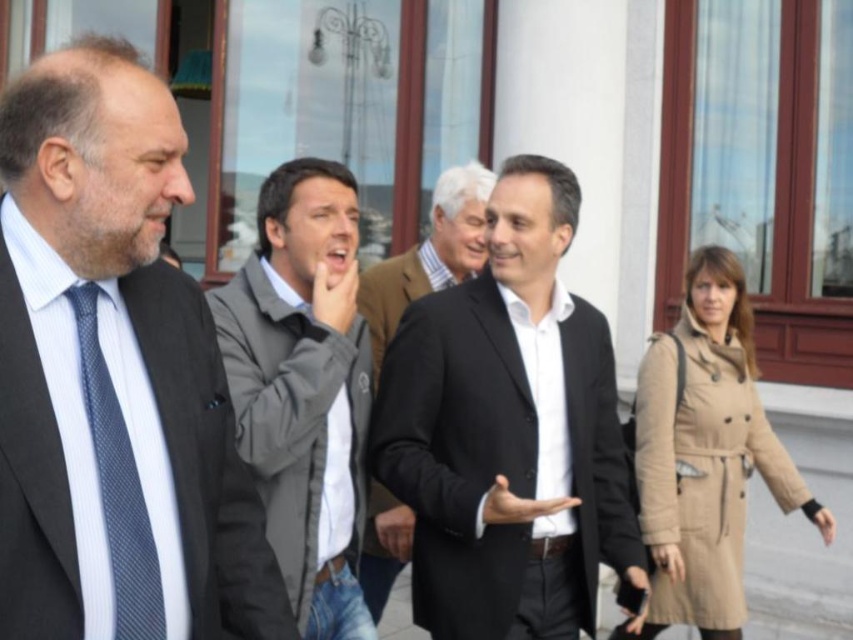
You are standing in front of the building with large windows. You notice two points marked in the scene. The first point is at coordinate point (x=76, y=83) and the second is at point (x=521, y=573). Which point is closer to you?

Point (x=76, y=83) is closer to the viewer than point (x=521, y=573).

You are a photographer standing 3 meters away from the black wool coat at center and the black wool suit at center. You want to capture both in a single shot without zooming. Can you fit both into your camera frame if your camera has a 1.5 meter field of view?

The distance between the black wool coat at center and black wool suit at center is 2.46 meters. Since your camera has a 1.5 meter field of view, which is shorter than the distance between them, you cannot fit both into your camera frame without zooming.